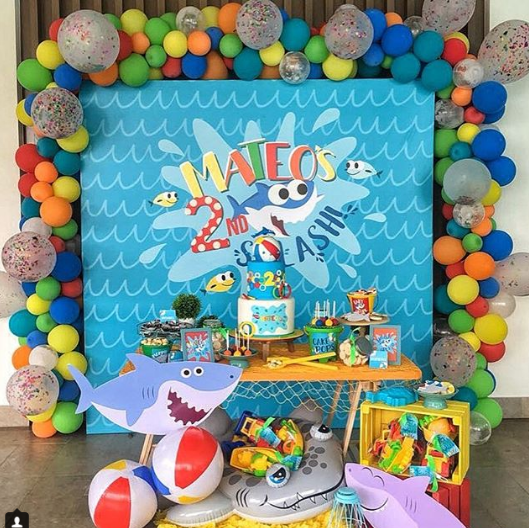
Find the location of a particular element. This screenshot has width=529, height=528. toys is located at coordinates (259, 457), (264, 431), (400, 441), (436, 442).